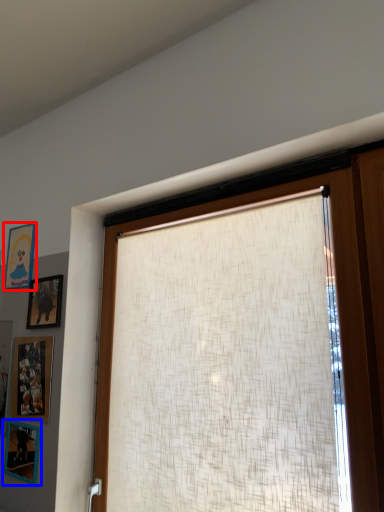
Question: Which object is closer to the camera taking this photo, picture frame (highlighted by a red box) or picture frame (highlighted by a blue box)?

Choices:
 (A) picture frame
 (B) picture frame

Answer: (B)